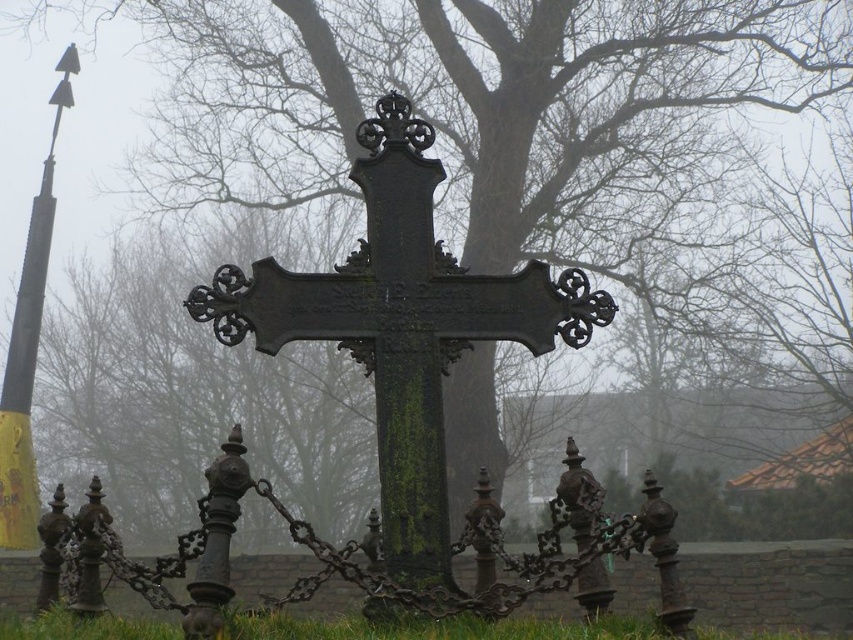
Describe the element at coordinates (363, 550) in the screenshot. I see `rusty metal fence at center` at that location.

How distant is rusty metal fence at center from green grass at lower center?

rusty metal fence at center is 12.05 feet away from green grass at lower center.

Who is more forward, (x=212, y=586) or (x=488, y=627)?

Point (x=212, y=586) is in front.

This screenshot has height=640, width=853. In order to click on rusty metal fence at center in this screenshot , I will do `click(363, 550)`.

Between green mossy metal cross at center and green grass at lower center, which one is positioned lower?

green grass at lower center is below.

Is point (426, 177) positioned before point (641, 636)?

No, (426, 177) is behind (641, 636).

The width and height of the screenshot is (853, 640). What do you see at coordinates (402, 326) in the screenshot?
I see `green mossy metal cross at center` at bounding box center [402, 326].

Find the location of a particular element. The height and width of the screenshot is (640, 853). green mossy metal cross at center is located at coordinates (402, 326).

Who is taller, rusty metal fence at center or yellow painted metal pole at left?

With more height is rusty metal fence at center.

Who is higher up, rusty metal fence at center or yellow painted metal pole at left?

yellow painted metal pole at left

Is point (155, 586) less distant than point (39, 312)?

Yes, it is in front of point (39, 312).

You are a GUI agent. You are given a task and a screenshot of the screen. Output one action in this format:
    pyautogui.click(x=<x>, y=<y>)
    Task: Click on the rusty metal fence at center
    
    Given the screenshot: What is the action you would take?
    pyautogui.click(x=363, y=550)